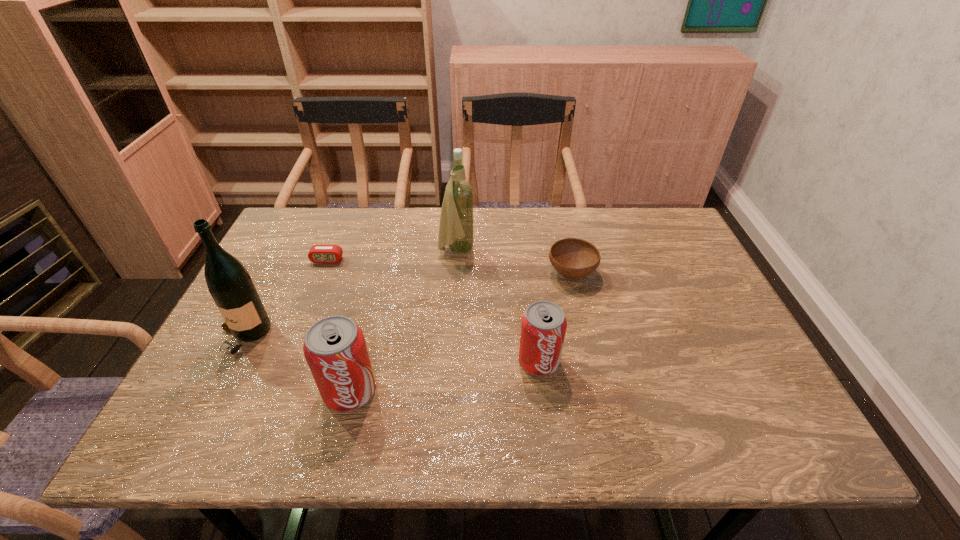
I want to click on free area in between the bowl and the third object from left to right, so click(x=461, y=332).

Where is `blank region between the taller soda can and the right soda can`? The width and height of the screenshot is (960, 540). blank region between the taller soda can and the right soda can is located at coordinates (444, 376).

You are a GUI agent. You are given a task and a screenshot of the screen. Output one action in this format:
    pyautogui.click(x=<x>, y=<y>)
    Task: Click on the vacant area that lies between the right wine bottle and the shorter soda can
    
    Given the screenshot: What is the action you would take?
    pyautogui.click(x=497, y=306)

Where is `unoccupied area between the rightmost object and the left soda can`? The width and height of the screenshot is (960, 540). unoccupied area between the rightmost object and the left soda can is located at coordinates (461, 332).

Where is `vacant space in between the leftmost object and the right soda can`? This screenshot has width=960, height=540. vacant space in between the leftmost object and the right soda can is located at coordinates (392, 349).

Identify the location of free spot between the taller soda can and the bowl. The height and width of the screenshot is (540, 960). (461, 332).

This screenshot has height=540, width=960. Identify the location of free point between the right wine bottle and the second shortest object. (514, 262).

Identify which object is the fourth closest to the shorter soda can. Please provide its 2D coordinates. Your answer should be formatted as a tuple, i.e. [(x, y)], where the tuple contains the x and y coordinates of a point satisfying the conditions above.

[(318, 253)]

Locate which object ranks third in proximity to the right soda can. Please provide its 2D coordinates. Your answer should be formatted as a tuple, i.e. [(x, y)], where the tuple contains the x and y coordinates of a point satisfying the conditions above.

[(456, 229)]

You are a GUI agent. You are given a task and a screenshot of the screen. Output one action in this format:
    pyautogui.click(x=<x>, y=<y>)
    Task: Click on the free space in the image that satisfies the following two spatial constraints: 1. on the front-facing side of the third object from right to left; 2. on the front side of the left soda can
    This screenshot has width=960, height=540.
    Given the screenshot: What is the action you would take?
    pyautogui.click(x=447, y=391)